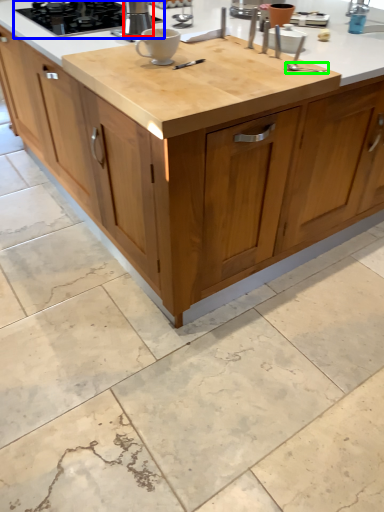
Question: Estimate the real-world distances between objects in this image. Which object is farther from kitchen appliance (highlighted by a red box), gas stove (highlighted by a blue box) or utensil (highlighted by a green box)?

Choices:
 (A) gas stove
 (B) utensil

Answer: (B)